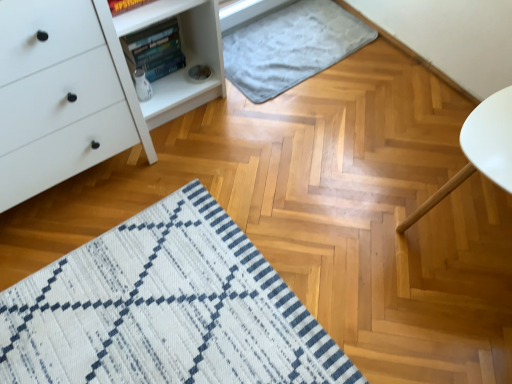
Where is `vacant space that is to the left of white matte table at right`? The image size is (512, 384). vacant space that is to the left of white matte table at right is located at coordinates (358, 236).